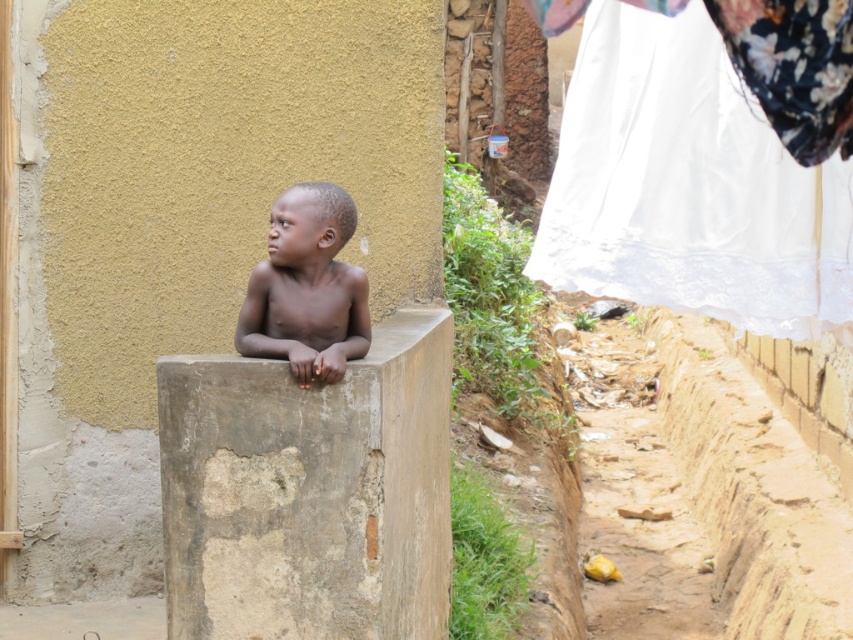
Who is positioned more to the left, gray concrete wall at center or dark skin/smooth skin/boy at center?

From the viewer's perspective, dark skin/smooth skin/boy at center appears more on the left side.

In the scene shown: Can you confirm if gray concrete wall at center is positioned above dark skin/smooth skin/boy at center?

No.

This screenshot has height=640, width=853. What do you see at coordinates (309, 492) in the screenshot? I see `gray concrete wall at center` at bounding box center [309, 492].

Identify the location of gray concrete wall at center. (309, 492).

Is white lace fabric at upper right taller than dark skin/smooth skin/boy at center?

Yes, white lace fabric at upper right is taller than dark skin/smooth skin/boy at center.

Find the location of a particular element. This screenshot has height=640, width=853. white lace fabric at upper right is located at coordinates (689, 186).

The image size is (853, 640). Find the location of `white lace fabric at upper right`. white lace fabric at upper right is located at coordinates (689, 186).

Looking at this image, can you confirm if gray concrete wall at center is positioned to the right of white lace fabric at upper right?

No, gray concrete wall at center is not to the right of white lace fabric at upper right.

Which is behind, point (184, 440) or point (756, 241)?

The point (184, 440) is behind.

Identify the location of gray concrete wall at center. The image size is (853, 640). (309, 492).